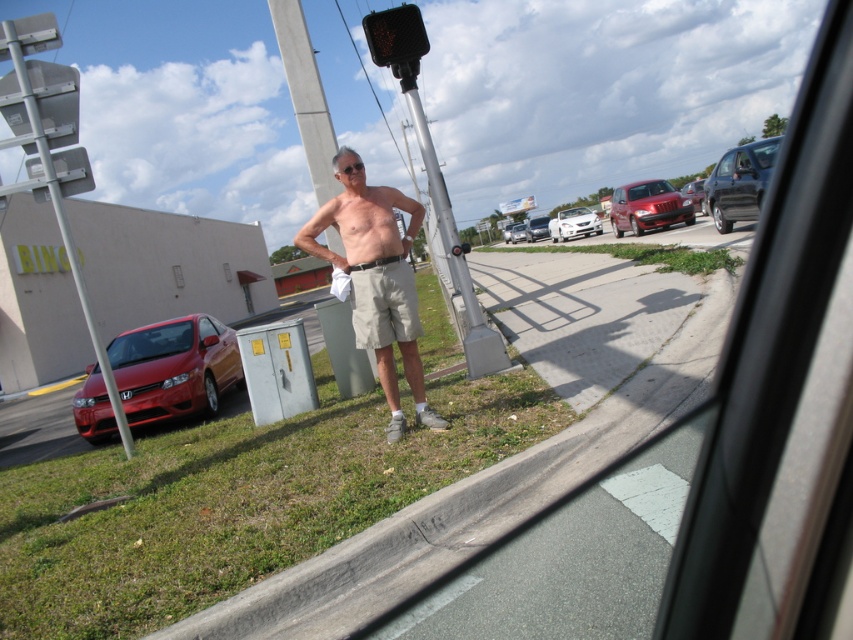
You are standing at the point marked as point [694,193] in the image. Looking around, what object is directly in front of you?

The point [694,193] corresponds to the shiny red sedan at center right, so the shiny red sedan at center right is directly in front of you.